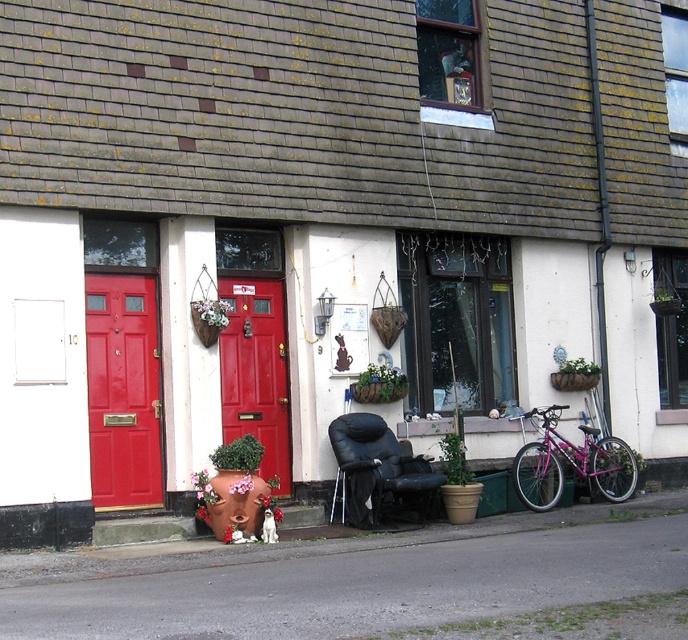
You are standing in front of the building and want to enter through the matte red door at left. Based on its coordinates, is the door located on the left or right side of the building?

The matte red door at left is located at coordinates point (122, 390), which places it on the left side of the building.